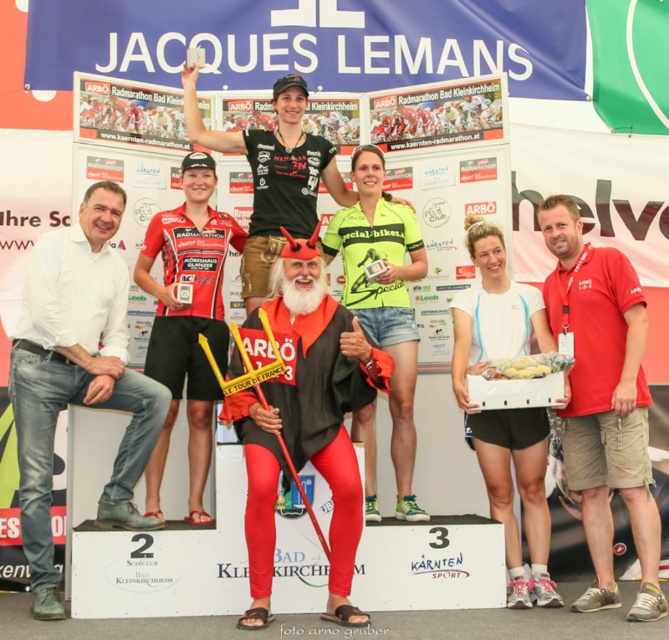
Question: Which is nearer to the red matte devil costume at center?

Choices:
 (A) red fabric skier at center
 (B) black matte jersey at center
 (C) red cotton shirt at right

Answer: (A)

Question: Among these points, which one is nearest to the camera?

Choices:
 (A) (173, 288)
 (B) (328, 531)
 (C) (294, 214)
 (D) (561, 198)

Answer: (B)

Question: Is red matte devil costume at center positioned at the back of black matte jersey at center?

Choices:
 (A) yes
 (B) no

Answer: (B)

Question: Does red matte devil costume at center have a greater width compared to red fabric skier at center?

Choices:
 (A) yes
 (B) no

Answer: (A)

Question: Which of the following is the closest to the observer?

Choices:
 (A) (39, 518)
 (B) (294, 88)
 (C) (191, 195)

Answer: (A)

Question: Observing the image, what is the correct spatial positioning of red matte devil costume at center in reference to black matte jersey at center?

Choices:
 (A) left
 (B) right

Answer: (B)